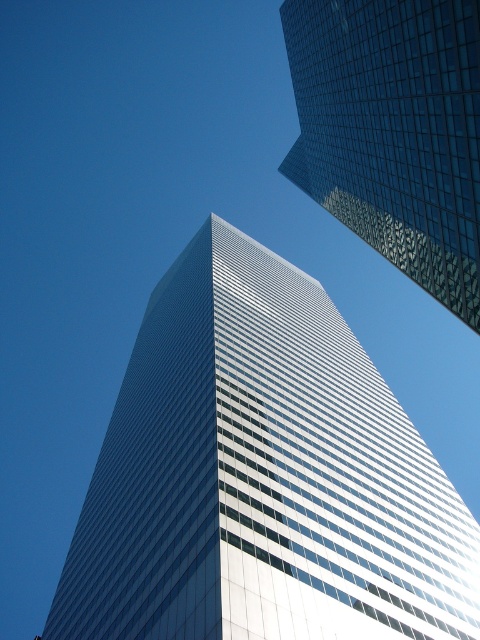
Consider the image. Who is more distant from viewer, (106,454) or (391,42)?

Positioned behind is point (106,454).

Can you confirm if glassy reflective skyscraper at center is positioned to the right of glassy reflective skyscraper at upper right?

In fact, glassy reflective skyscraper at center is to the left of glassy reflective skyscraper at upper right.

Does point (263, 337) come behind point (408, 140)?

Yes, it is.

Find the location of a particular element. This screenshot has width=480, height=640. glassy reflective skyscraper at center is located at coordinates (262, 476).